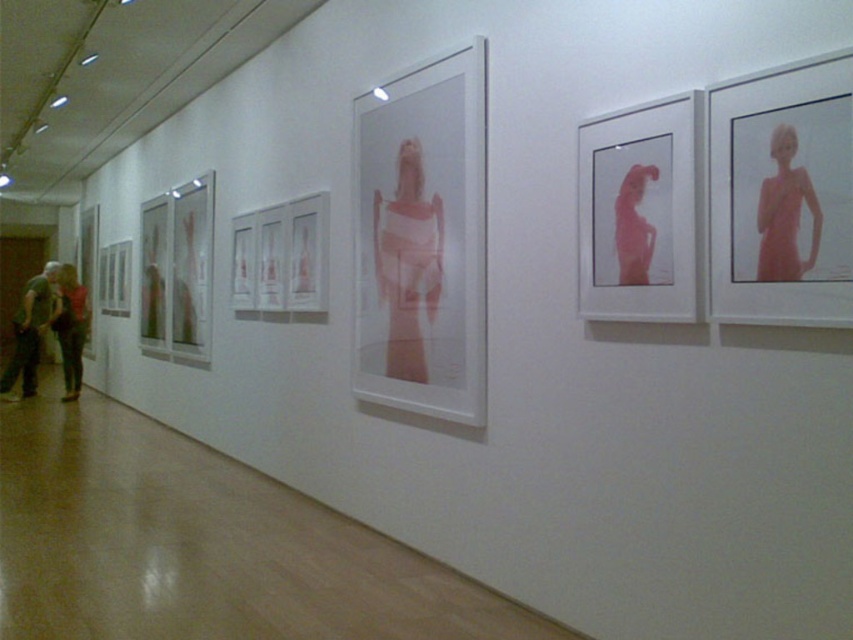
Can you confirm if green cotton shirt at left is positioned to the right of pink matte dress at center?

No, green cotton shirt at left is not to the right of pink matte dress at center.

Between green cotton shirt at left and pink matte dress at center, which one has less height?

Standing shorter between the two is green cotton shirt at left.

Locate an element on the screen. The width and height of the screenshot is (853, 640). green cotton shirt at left is located at coordinates (30, 330).

Who is more forward, (186, 280) or (792, 180)?

Point (792, 180) is in front.

Does translucent glass figure at center appear over pink matte dress at upper right?

Yes.

Identify the location of translucent glass figure at center. This screenshot has height=640, width=853. (177, 269).

Does translucent white dress at center lie behind matte black jacket at lower left?

No, it is in front of matte black jacket at lower left.

Does translucent white dress at center have a greater width compared to matte black jacket at lower left?

In fact, translucent white dress at center might be narrower than matte black jacket at lower left.

At what (x,y) coordinates should I click in order to perform the action: click on translucent white dress at center. Please return your answer as a coordinate pair (x, y). The height and width of the screenshot is (640, 853). Looking at the image, I should click on (407, 262).

This screenshot has width=853, height=640. What are the coordinates of `translucent white dress at center` in the screenshot? It's located at (407, 262).